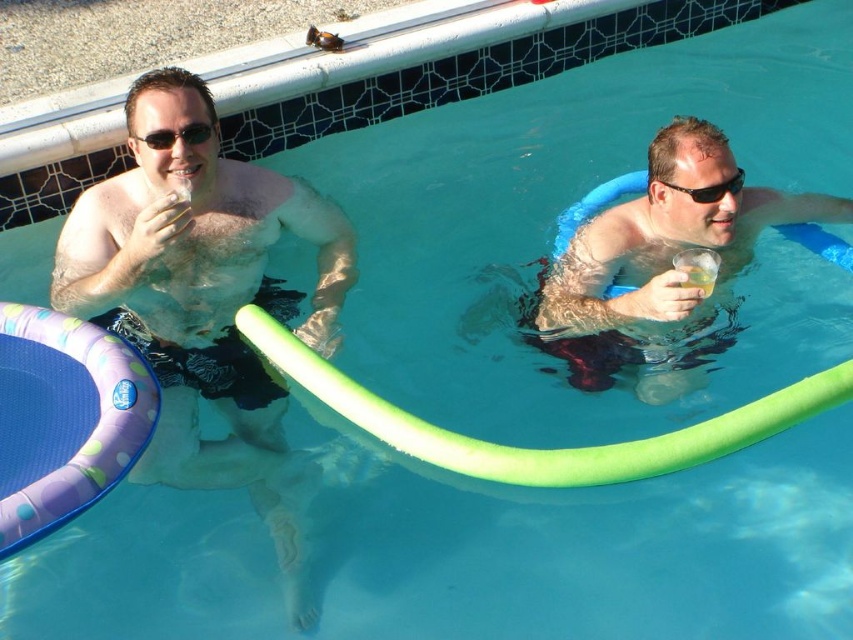
Question: Which object appears farthest from the camera in this image?

Choices:
 (A) matte black sunglasses at upper left
 (B) matte black shorts at left
 (C) black plastic goggles at upper right
 (D) matte blue float at right

Answer: (A)

Question: Does matte black sunglasses at upper left appear over black plastic goggles at upper right?

Choices:
 (A) yes
 (B) no

Answer: (A)

Question: Is matte black sunglasses at upper left to the right of black plastic goggles at upper right from the viewer's perspective?

Choices:
 (A) yes
 (B) no

Answer: (B)

Question: Does matte black sunglasses at upper left have a greater width compared to black plastic goggles at upper right?

Choices:
 (A) no
 (B) yes

Answer: (A)

Question: Among these objects, which one is nearest to the camera?

Choices:
 (A) black plastic goggles at upper right
 (B) matte blue float at right

Answer: (B)

Question: Which object is farther from the camera taking this photo?

Choices:
 (A) matte blue float at right
 (B) matte black shorts at left
 (C) black plastic goggles at upper right

Answer: (C)